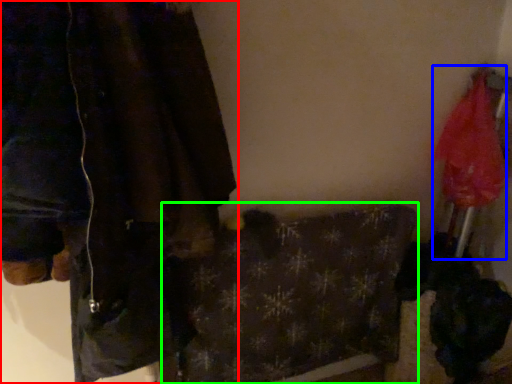
Question: Based on their relative distances, which object is farther from jacket (highlighted by a red box)? Choose from umbrella (highlighted by a blue box) and blanket (highlighted by a green box).

Choices:
 (A) umbrella
 (B) blanket

Answer: (A)